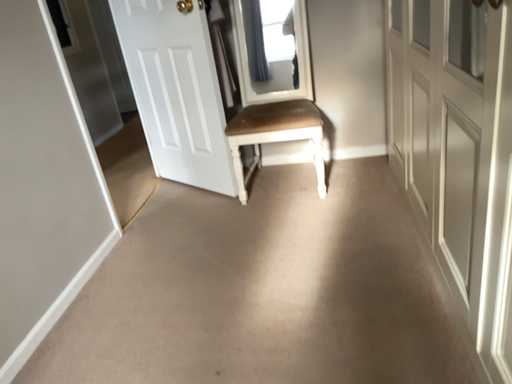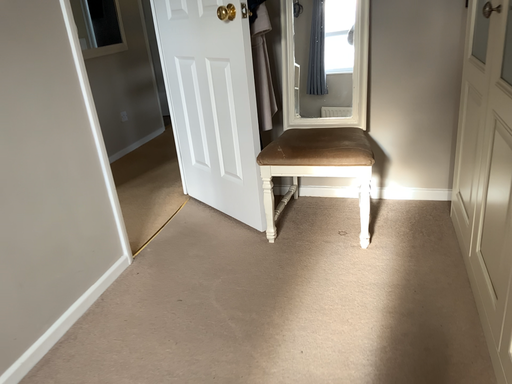
Question: Which way did the camera rotate in the video?

Choices:
 (A) rotated right
 (B) rotated left

Answer: (B)